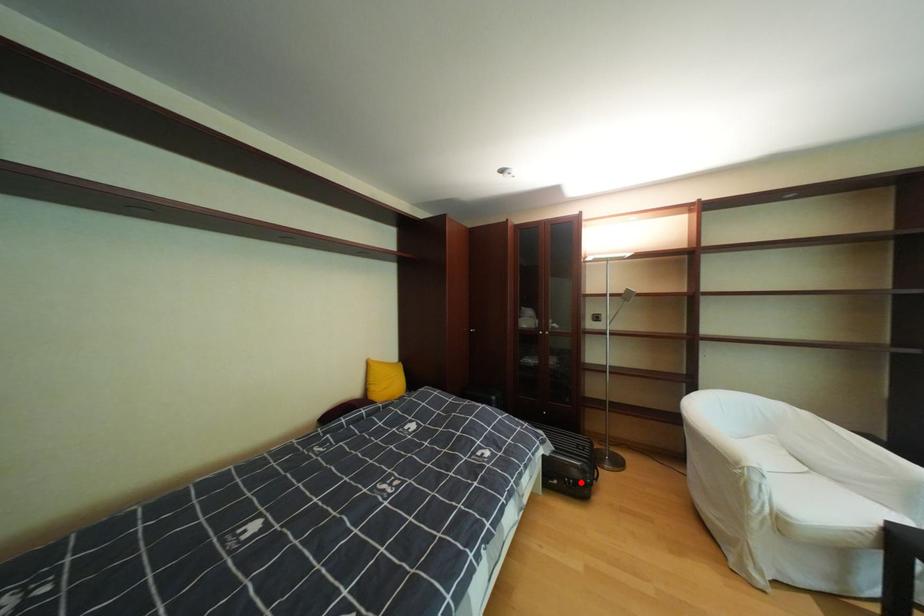
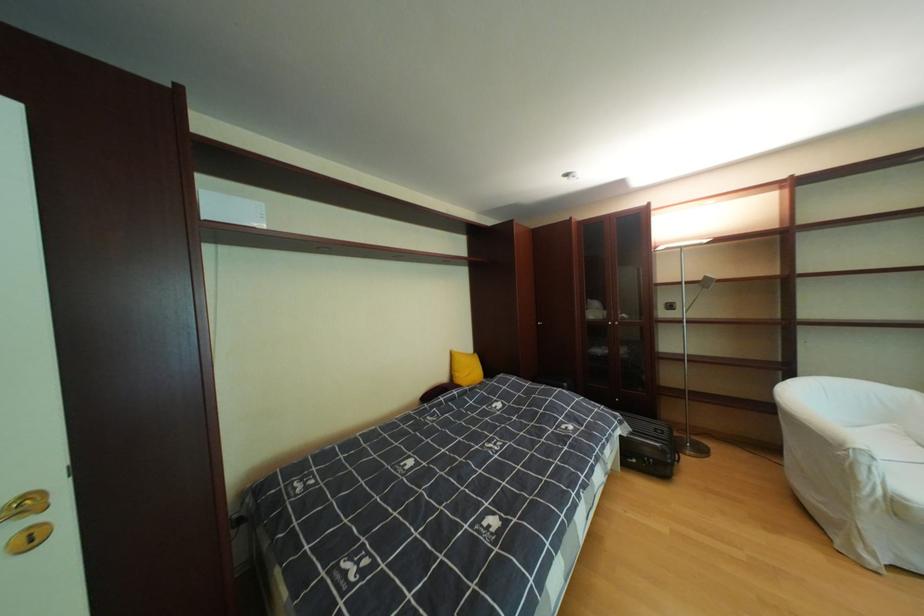
Question: I am providing you with two images of the same scene from different viewpoints. In image1, a red point is highlighted. Considering the same 3D point in image2, which of the following is correct?

Choices:
 (A) It is closer
 (B) It is farther

Answer: (A)